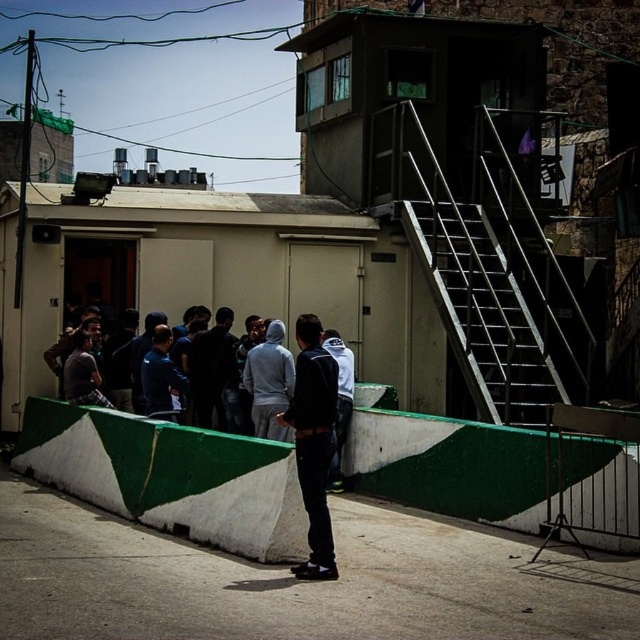
Is point (304, 500) farther from camera compared to point (200, 333)?

No, it is not.

Is point (291, 417) less distant than point (208, 349)?

Yes, it is.

Identify the location of dark blue jeans at center. The width and height of the screenshot is (640, 640). (314, 442).

Is point (205, 388) behind point (337, 460)?

Yes, point (205, 388) is behind point (337, 460).

Does dark blue hoodie at center have a lesser width compared to white matte jacket at center?

No.

Is point (218, 348) farther from camera compared to point (326, 486)?

Yes, point (218, 348) is farther from viewer.

At what (x,y) coordinates should I click in order to perform the action: click on dark blue hoodie at center. Please return your answer as a coordinate pair (x, y). Looking at the image, I should click on coord(211,369).

Is point (316, 422) farther from camera compared to point (340, 385)?

No, it is not.

Who is positioned more to the right, dark blue jeans at center or white matte jacket at center?

Positioned to the right is white matte jacket at center.

Describe the element at coordinates (314, 442) in the screenshot. This screenshot has height=640, width=640. I see `dark blue jeans at center` at that location.

Image resolution: width=640 pixels, height=640 pixels. Find the location of `dark blue jeans at center`. dark blue jeans at center is located at coordinates (314, 442).